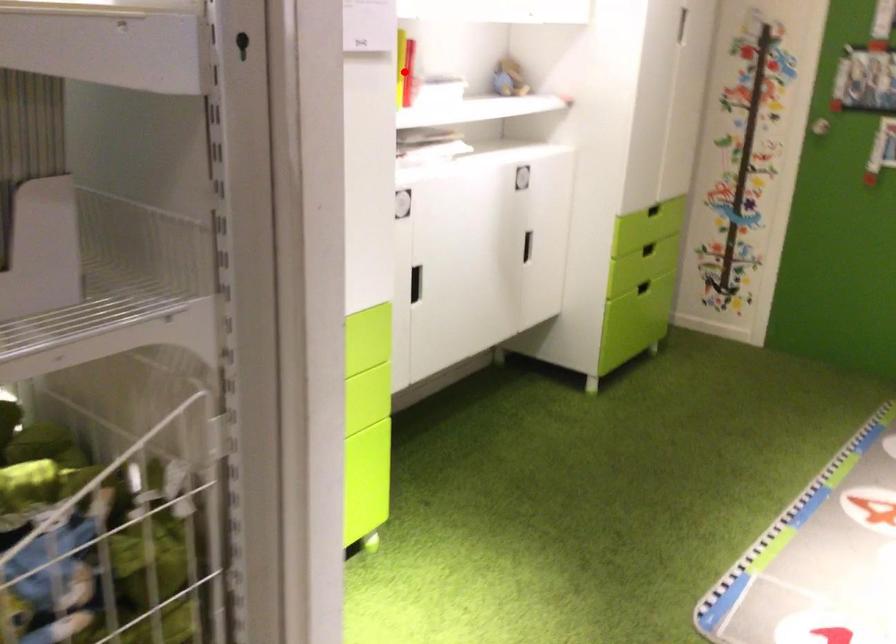
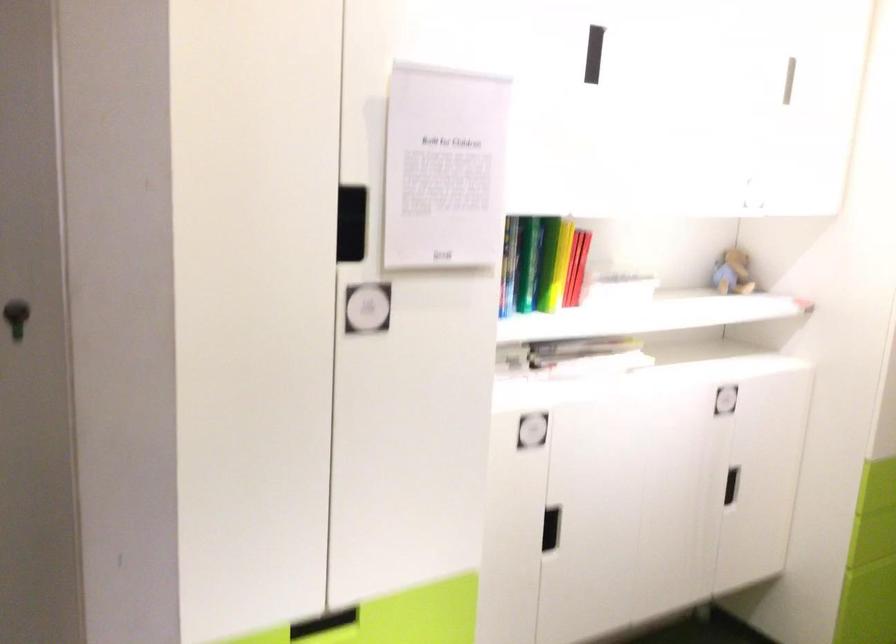
Question: I am providing you with two images of the same scene from different viewpoints. In image1, a red point is highlighted. Considering the same 3D point in image2, which of the following is correct?

Choices:
 (A) It is closer
 (B) It is farther

Answer: (A)